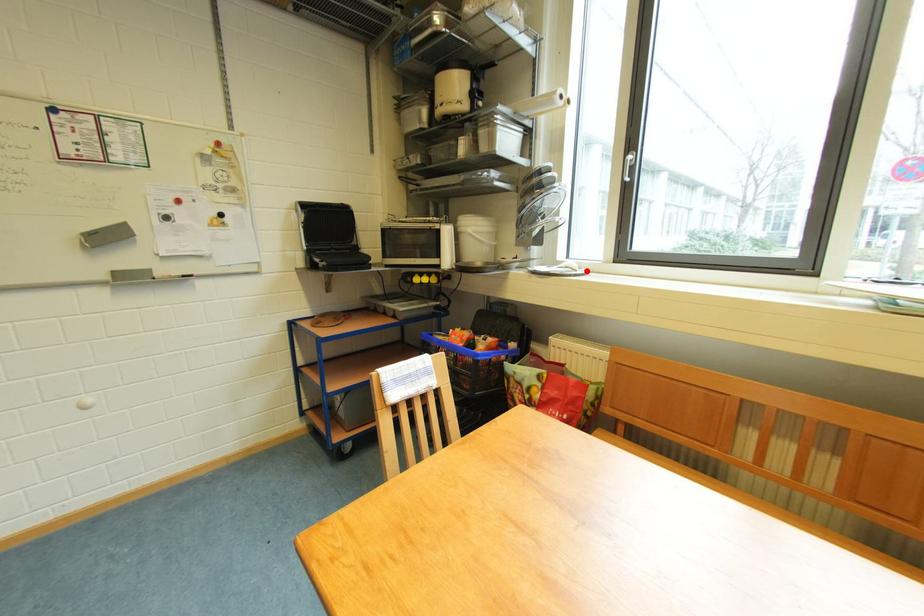
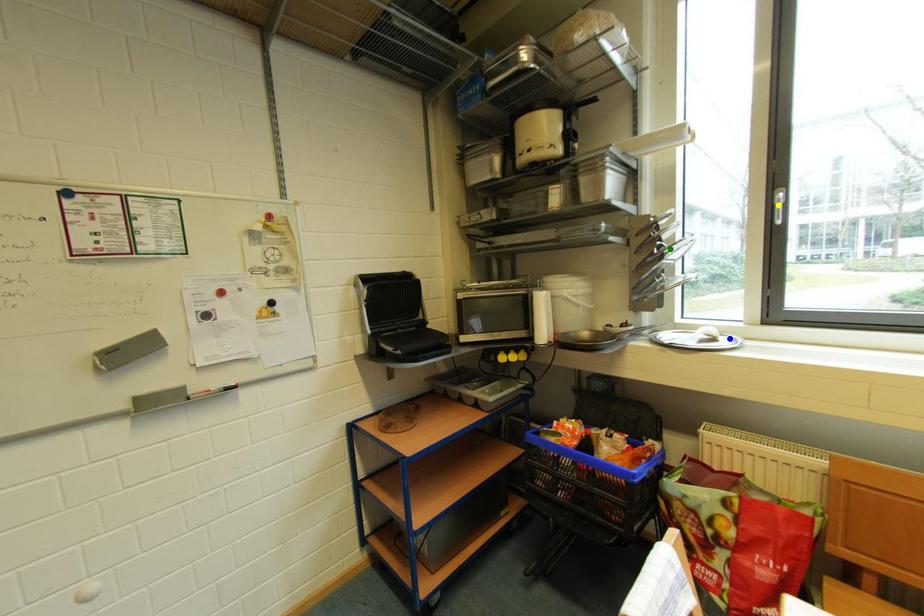
Question: I am providing you with two images of the same scene from different viewpoints. A red point is marked on the first image. You are given multiple points on the second image. Which point in image 2 represents the same 3d spot as the red point in image 1?

Choices:
 (A) blue point
 (B) yellow point
 (C) green point

Answer: (A)